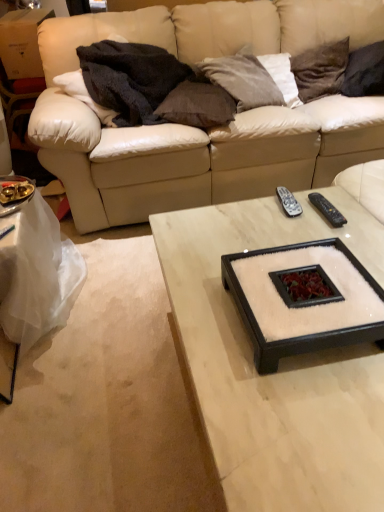
Question: Does dark gray fabric pillow at upper right, acting as the 4th pillow starting from the left, have a lesser height compared to brown fabric pillow at upper center, which ranks as the first pillow in left-to-right order?

Choices:
 (A) yes
 (B) no

Answer: (B)

Question: Is dark gray fabric pillow at upper right, acting as the first pillow starting from the right, taller than brown fabric pillow at upper center, which ranks as the first pillow in left-to-right order?

Choices:
 (A) yes
 (B) no

Answer: (A)

Question: Is dark gray fabric pillow at upper right, acting as the 4th pillow starting from the left, far away from brown fabric pillow at upper center, which ranks as the first pillow in left-to-right order?

Choices:
 (A) yes
 (B) no

Answer: (B)

Question: Is dark gray fabric pillow at upper right, acting as the first pillow starting from the right, further to the viewer compared to brown fabric pillow at upper center, which ranks as the first pillow in left-to-right order?

Choices:
 (A) no
 (B) yes

Answer: (B)

Question: Does dark gray fabric pillow at upper right, acting as the 4th pillow starting from the left, have a greater width compared to brown fabric pillow at upper center, which ranks as the first pillow in left-to-right order?

Choices:
 (A) yes
 (B) no

Answer: (A)

Question: Based on their sizes in the image, would you say dark fuzzy blanket at upper left is bigger or smaller than dark brown velvet pillow at upper right, the 2th pillow viewed from the right?

Choices:
 (A) big
 (B) small

Answer: (A)

Question: Considering the positions of dark fuzzy blanket at upper left and dark brown velvet pillow at upper right, the 2th pillow viewed from the right, in the image, is dark fuzzy blanket at upper left wider or thinner than dark brown velvet pillow at upper right, the 2th pillow viewed from the right,?

Choices:
 (A) thin
 (B) wide

Answer: (B)

Question: Considering the positions of dark fuzzy blanket at upper left and dark brown velvet pillow at upper right, the 2th pillow viewed from the right, in the image, is dark fuzzy blanket at upper left taller or shorter than dark brown velvet pillow at upper right, the 2th pillow viewed from the right,?

Choices:
 (A) tall
 (B) short

Answer: (B)

Question: Is point (152, 119) closer or farther from the camera than point (337, 51)?

Choices:
 (A) farther
 (B) closer

Answer: (B)

Question: From the image's perspective, is beige leather couch at upper center located above or below dark brown velvet pillow at upper right, which appears as the 3th pillow when viewed from the left?

Choices:
 (A) below
 (B) above

Answer: (A)

Question: Relative to dark brown velvet pillow at upper right, which appears as the 3th pillow when viewed from the left, is beige leather couch at upper center in front or behind?

Choices:
 (A) front
 (B) behind

Answer: (A)

Question: Based on their sizes in the image, would you say beige leather couch at upper center is bigger or smaller than dark brown velvet pillow at upper right, which appears as the 3th pillow when viewed from the left?

Choices:
 (A) small
 (B) big

Answer: (B)

Question: From their relative heights in the image, would you say beige leather couch at upper center is taller or shorter than dark brown velvet pillow at upper right, which appears as the 3th pillow when viewed from the left?

Choices:
 (A) tall
 (B) short

Answer: (A)

Question: In terms of height, does brown fabric pillow at upper center, which ranks as the first pillow in left-to-right order, look taller or shorter compared to dark brown velvet pillow at upper right, the 2th pillow viewed from the right?

Choices:
 (A) tall
 (B) short

Answer: (B)

Question: From the image's perspective, is brown fabric pillow at upper center, which ranks as the first pillow in left-to-right order, positioned above or below dark brown velvet pillow at upper right, the 2th pillow viewed from the right?

Choices:
 (A) above
 (B) below

Answer: (B)